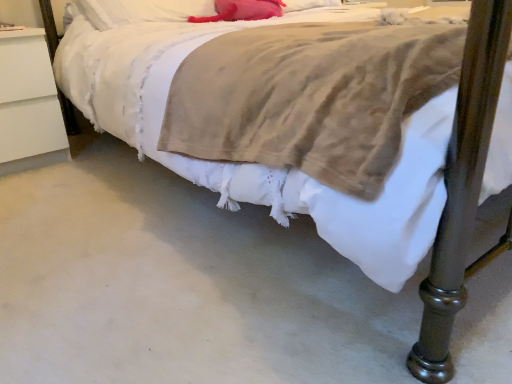
Where is `white matte nightstand at left`? white matte nightstand at left is located at coordinates (29, 104).

Identify the location of white soft pillow at upper center, which is counted as the 2th pillow, starting from the right. The height and width of the screenshot is (384, 512). (142, 11).

You are a GUI agent. You are given a task and a screenshot of the screen. Output one action in this format:
    pyautogui.click(x=<x>, y=<y>)
    Task: Click on the matte pink pillow at upper center, the 1th pillow positioned from the right
    The image size is (512, 384).
    Given the screenshot: What is the action you would take?
    pyautogui.click(x=242, y=10)

This screenshot has width=512, height=384. I want to click on pillow directly beneath the white soft pillow at upper center, acting as the 1th pillow starting from the left (from a real-world perspective), so click(x=242, y=10).

Does point (236, 1) come closer to viewer compared to point (157, 1)?

Yes, it is in front of point (157, 1).

Considering the relative sizes of matte pink pillow at upper center, the 1th pillow positioned from the right, and white soft pillow at upper center, acting as the 1th pillow starting from the left, in the image provided, is matte pink pillow at upper center, the 1th pillow positioned from the right, shorter than white soft pillow at upper center, acting as the 1th pillow starting from the left,?

Indeed, matte pink pillow at upper center, the 1th pillow positioned from the right, has a lesser height compared to white soft pillow at upper center, acting as the 1th pillow starting from the left.

Does matte pink pillow at upper center, the 1th pillow positioned from the right, have a greater height compared to white matte nightstand at left?

No.

Which object is closer to the camera taking this photo, matte pink pillow at upper center, the 1th pillow positioned from the right, or white matte nightstand at left?

white matte nightstand at left is closer to the camera.

How different are the orientations of matte pink pillow at upper center, the 1th pillow positioned from the right, and white matte nightstand at left in degrees?

They differ by 8.38 degrees in their facing directions.

Is white soft pillow at upper center, which is counted as the 2th pillow, starting from the right, placed right next to white matte nightstand at left?

No, white soft pillow at upper center, which is counted as the 2th pillow, starting from the right, is not in contact with white matte nightstand at left.

From the image's perspective, is white soft pillow at upper center, acting as the 1th pillow starting from the left, above white matte nightstand at left?

Yes, from the image's perspective, white soft pillow at upper center, acting as the 1th pillow starting from the left, is above white matte nightstand at left.

Is white soft pillow at upper center, which is counted as the 2th pillow, starting from the right, looking in the opposite direction of white matte nightstand at left?

No.

Who is bigger, white soft pillow at upper center, acting as the 1th pillow starting from the left, or white matte nightstand at left?

Bigger between the two is white matte nightstand at left.

Is white matte nightstand at left wider or thinner than matte pink pillow at upper center, the 2th pillow positioned from the left?

Clearly, white matte nightstand at left has more width compared to matte pink pillow at upper center, the 2th pillow positioned from the left.

Is matte pink pillow at upper center, the 1th pillow positioned from the right, inside white matte nightstand at left?

That's incorrect, matte pink pillow at upper center, the 1th pillow positioned from the right, is not inside white matte nightstand at left.

The width and height of the screenshot is (512, 384). I want to click on the 1st pillow positioned above the white matte nightstand at left (from a real-world perspective), so click(x=242, y=10).

In the scene shown: Considering the relative sizes of white matte nightstand at left and matte pink pillow at upper center, the 1th pillow positioned from the right, in the image provided, is white matte nightstand at left bigger than matte pink pillow at upper center, the 1th pillow positioned from the right,?

Yes, white matte nightstand at left is bigger than matte pink pillow at upper center, the 1th pillow positioned from the right.

From the image's perspective, relative to white soft pillow at upper center, acting as the 1th pillow starting from the left, is white matte nightstand at left above or below?

white matte nightstand at left is below white soft pillow at upper center, acting as the 1th pillow starting from the left.

Is point (27, 166) closer to viewer compared to point (118, 19)?

Yes, it is in front of point (118, 19).

From a real-world perspective, between white matte nightstand at left and white soft pillow at upper center, which is counted as the 2th pillow, starting from the right, who is vertically higher?

In real-world perspective, white soft pillow at upper center, which is counted as the 2th pillow, starting from the right, is above.

Is white matte nightstand at left looking in the opposite direction of white soft pillow at upper center, acting as the 1th pillow starting from the left?

No, white matte nightstand at left is not facing away from white soft pillow at upper center, acting as the 1th pillow starting from the left.

Is the depth of white soft pillow at upper center, acting as the 1th pillow starting from the left, less than that of matte pink pillow at upper center, the 1th pillow positioned from the right?

Yes.

Between white soft pillow at upper center, acting as the 1th pillow starting from the left, and matte pink pillow at upper center, the 1th pillow positioned from the right, which one has larger width?

With larger width is matte pink pillow at upper center, the 1th pillow positioned from the right.

In terms of size, does white soft pillow at upper center, which is counted as the 2th pillow, starting from the right, appear bigger or smaller than matte pink pillow at upper center, the 1th pillow positioned from the right?

Clearly, white soft pillow at upper center, which is counted as the 2th pillow, starting from the right, is larger in size than matte pink pillow at upper center, the 1th pillow positioned from the right.

Locate an element on the screen. Image resolution: width=512 pixels, height=384 pixels. pillow below the white soft pillow at upper center, which is counted as the 2th pillow, starting from the right (from a real-world perspective) is located at coordinates (242, 10).

Identify the location of the 2nd pillow to the right of the white matte nightstand at left, counting from the anchor's position. (242, 10).

Based on their spatial positions, is matte pink pillow at upper center, the 1th pillow positioned from the right, or white soft pillow at upper center, acting as the 1th pillow starting from the left, closer to white matte nightstand at left?

Based on the image, white soft pillow at upper center, acting as the 1th pillow starting from the left, appears to be nearer to white matte nightstand at left.

Considering their positions, is white soft pillow at upper center, which is counted as the 2th pillow, starting from the right, positioned closer to white matte nightstand at left than matte pink pillow at upper center, the 1th pillow positioned from the right?

white soft pillow at upper center, which is counted as the 2th pillow, starting from the right, lies closer to white matte nightstand at left than the other object.

From the picture: Considering their positions, is white soft pillow at upper center, acting as the 1th pillow starting from the left, positioned further to matte pink pillow at upper center, the 2th pillow positioned from the left, than white matte nightstand at left?

Among the two, white matte nightstand at left is located further to matte pink pillow at upper center, the 2th pillow positioned from the left.

From the image, which object appears to be farther from white soft pillow at upper center, which is counted as the 2th pillow, starting from the right, white matte nightstand at left or matte pink pillow at upper center, the 1th pillow positioned from the right?

white matte nightstand at left is positioned further to the anchor white soft pillow at upper center, which is counted as the 2th pillow, starting from the right.

When comparing their distances from matte pink pillow at upper center, the 1th pillow positioned from the right, does white matte nightstand at left or white soft pillow at upper center, which is counted as the 2th pillow, starting from the right, seem further?

white matte nightstand at left is positioned further to the anchor matte pink pillow at upper center, the 1th pillow positioned from the right.

Based on their spatial positions, is matte pink pillow at upper center, the 1th pillow positioned from the right, or white matte nightstand at left further from white soft pillow at upper center, which is counted as the 2th pillow, starting from the right?

white matte nightstand at left is further to white soft pillow at upper center, which is counted as the 2th pillow, starting from the right.

The width and height of the screenshot is (512, 384). I want to click on pillow between white matte nightstand at left and matte pink pillow at upper center, the 1th pillow positioned from the right, so click(x=142, y=11).